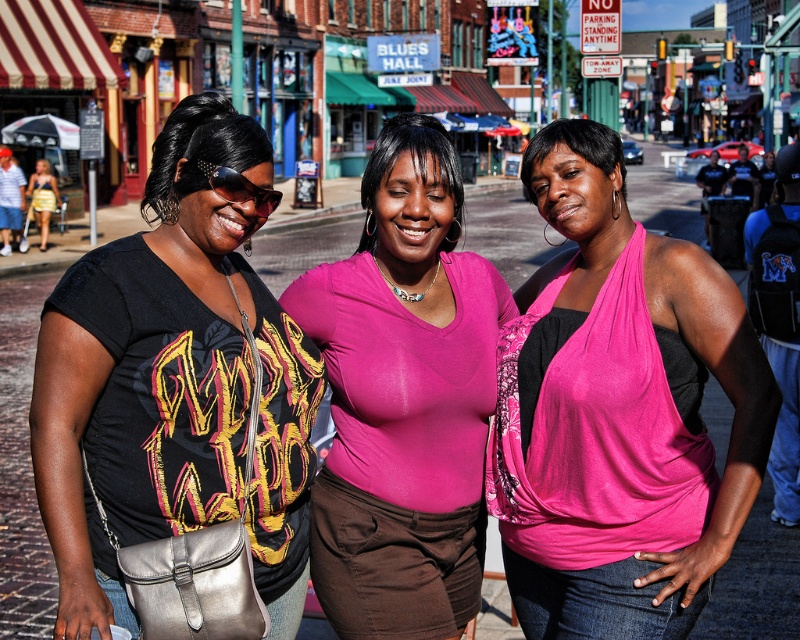
Question: Estimate the real-world distances between objects in this image. Which object is closer to the pink satin halter top at center?

Choices:
 (A) pink matte shirt at center
 (B) matte black shirt at center

Answer: (A)

Question: Is matte black shirt at center to the left of pink matte shirt at center from the viewer's perspective?

Choices:
 (A) no
 (B) yes

Answer: (B)

Question: Which point appears closest to the camera in this image?

Choices:
 (A) (389, 388)
 (B) (584, 561)
 (C) (218, 349)

Answer: (C)

Question: Can you confirm if pink satin halter top at center is positioned below matte black shirt at center?

Choices:
 (A) no
 (B) yes

Answer: (B)

Question: Which of the following is the farthest from the observer?

Choices:
 (A) (684, 396)
 (B) (106, 275)
 (C) (448, 355)

Answer: (C)

Question: Can you confirm if pink satin halter top at center is thinner than pink matte shirt at center?

Choices:
 (A) no
 (B) yes

Answer: (A)